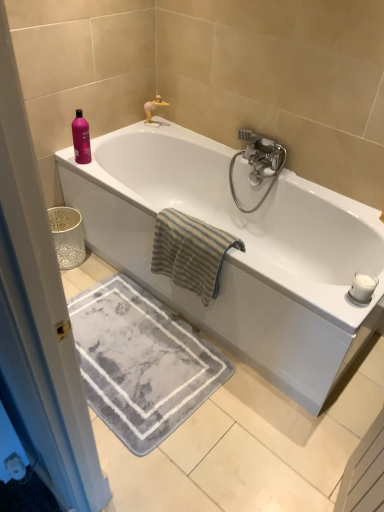
Question: Can you confirm if white glossy bathtub at upper center is positioned to the right of satin nickel faucet at upper right?

Choices:
 (A) no
 (B) yes

Answer: (A)

Question: Is white glossy bathtub at upper center at the left side of satin nickel faucet at upper right?

Choices:
 (A) no
 (B) yes

Answer: (B)

Question: From the image's perspective, is white glossy bathtub at upper center beneath satin nickel faucet at upper right?

Choices:
 (A) yes
 (B) no

Answer: (A)

Question: Is white glossy bathtub at upper center smaller than satin nickel faucet at upper right?

Choices:
 (A) no
 (B) yes

Answer: (A)

Question: From a real-world perspective, does white glossy bathtub at upper center sit lower than satin nickel faucet at upper right?

Choices:
 (A) no
 (B) yes

Answer: (B)

Question: Is silver metallic faucet at upper center in front of or behind pink glossy bottle at upper left in the image?

Choices:
 (A) front
 (B) behind

Answer: (B)

Question: Is point tap(160, 98) closer or farther from the camera than point tap(79, 112)?

Choices:
 (A) closer
 (B) farther

Answer: (B)

Question: From the image's perspective, relative to pink glossy bottle at upper left, is silver metallic faucet at upper center above or below?

Choices:
 (A) below
 (B) above

Answer: (B)

Question: In terms of width, does silver metallic faucet at upper center look wider or thinner when compared to pink glossy bottle at upper left?

Choices:
 (A) wide
 (B) thin

Answer: (B)

Question: Based on their positions, is satin nickel faucet at upper right located to the left or right of gray soft rug at lower center?

Choices:
 (A) left
 (B) right

Answer: (B)

Question: In the image, is satin nickel faucet at upper right positioned in front of or behind gray soft rug at lower center?

Choices:
 (A) front
 (B) behind

Answer: (B)

Question: From the image's perspective, is satin nickel faucet at upper right above or below gray soft rug at lower center?

Choices:
 (A) above
 (B) below

Answer: (A)

Question: Considering the positions of satin nickel faucet at upper right and gray soft rug at lower center in the image, is satin nickel faucet at upper right wider or thinner than gray soft rug at lower center?

Choices:
 (A) thin
 (B) wide

Answer: (A)

Question: From the image's perspective, is silver metallic faucet at upper center above or below beige striped towel at center?

Choices:
 (A) above
 (B) below

Answer: (A)

Question: Considering the positions of silver metallic faucet at upper center and beige striped towel at center in the image, is silver metallic faucet at upper center taller or shorter than beige striped towel at center?

Choices:
 (A) tall
 (B) short

Answer: (B)